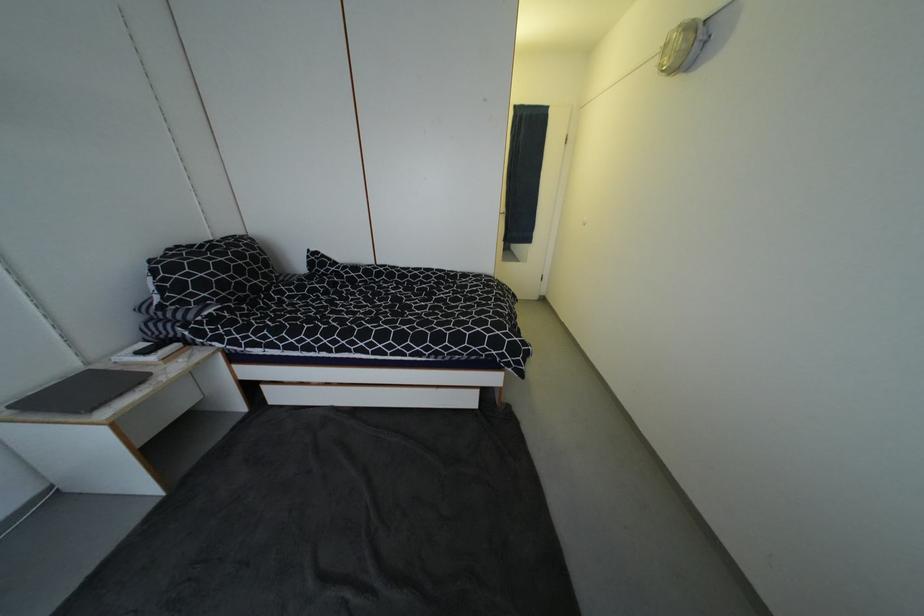
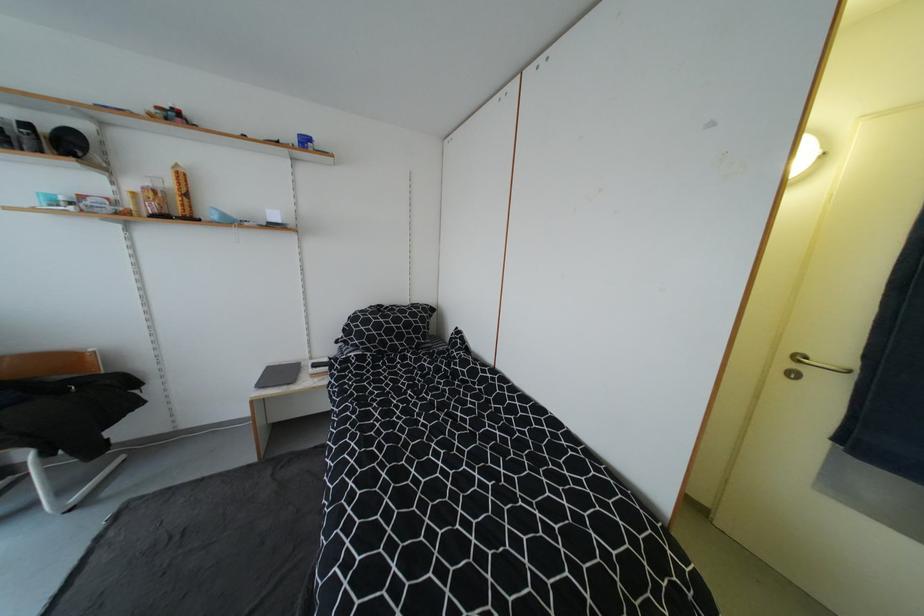
Locate, in the second image, the point that corresponds to point (195, 277) in the first image.

(362, 328)